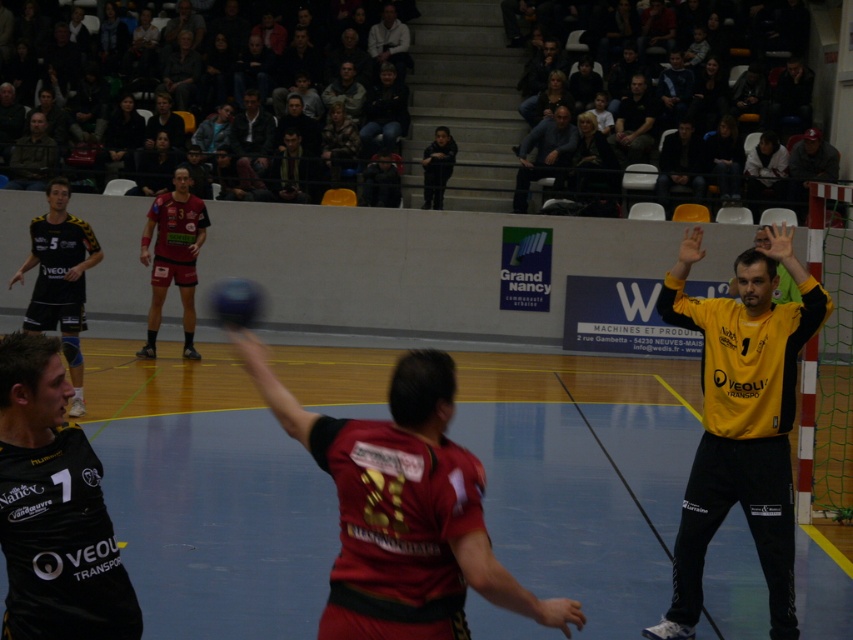
Question: Estimate the real-world distances between objects in this image. Which object is farther from the matte black jersey at center?

Choices:
 (A) dark blue jeans at center
 (B) black matte jersey at left

Answer: (B)

Question: Is matte black jersey at left smaller than light gray sweater at upper center?

Choices:
 (A) no
 (B) yes

Answer: (A)

Question: Is yellow jersey at right to the left of camouflage jacket at upper left from the viewer's perspective?

Choices:
 (A) no
 (B) yes

Answer: (A)

Question: Which point appears farthest from the camera in this image?

Choices:
 (A) click(550, 166)
 (B) click(61, 305)

Answer: (A)

Question: Is matte black jersey at left closer to the viewer compared to matte black jersey at center?

Choices:
 (A) no
 (B) yes

Answer: (B)

Question: Which of the following is the closest to the observer?

Choices:
 (A) light gray sweater at upper center
 (B) matte black jersey at center

Answer: (B)